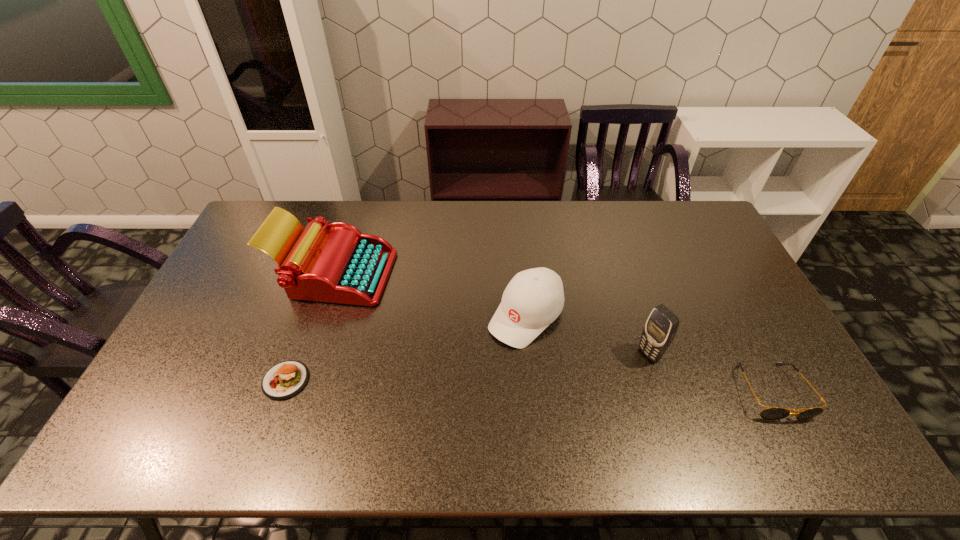
The height and width of the screenshot is (540, 960). Find the location of `object at the right edge`. object at the right edge is located at coordinates (771, 413).

Where is `object present at the near right corner`? The image size is (960, 540). object present at the near right corner is located at coordinates (771, 413).

The height and width of the screenshot is (540, 960). I want to click on vacant space at the far edge of the desktop, so click(308, 204).

You are a GUI agent. You are given a task and a screenshot of the screen. Output one action in this format:
    pyautogui.click(x=<x>, y=<y>)
    Task: Click on the vacant region at the near edge of the desktop
    The width and height of the screenshot is (960, 540).
    Given the screenshot: What is the action you would take?
    pyautogui.click(x=341, y=385)

Where is `blank space at the right edge`? The width and height of the screenshot is (960, 540). blank space at the right edge is located at coordinates (702, 279).

Locate an element on the screen. vacant space at the near left corner of the desktop is located at coordinates (158, 413).

Identify the location of vacant space at the far right corner of the desktop. (677, 202).

I want to click on empty space that is in between the third object from right to left and the second object from right to left, so click(588, 335).

Identify the location of unoccupied position between the fourth tallest object and the fourth object from left to right. (710, 373).

At what (x,y) coordinates should I click in order to perform the action: click on vacant space that's between the cellular telephone and the patty (food). Please return your answer as a coordinate pair (x, y). This screenshot has height=540, width=960. Looking at the image, I should click on (468, 367).